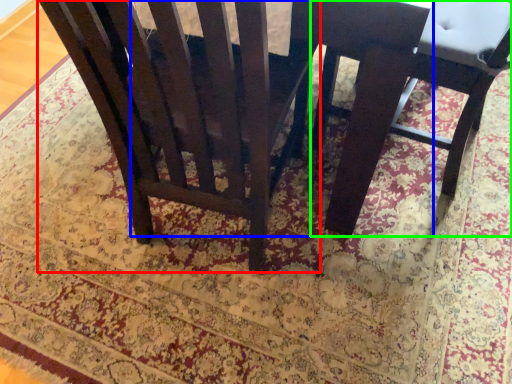
Question: Considering the real-world distances, which object is farthest from chair (highlighted by a red box)? round table (highlighted by a blue box) or chair (highlighted by a green box)?

Choices:
 (A) round table
 (B) chair

Answer: (B)